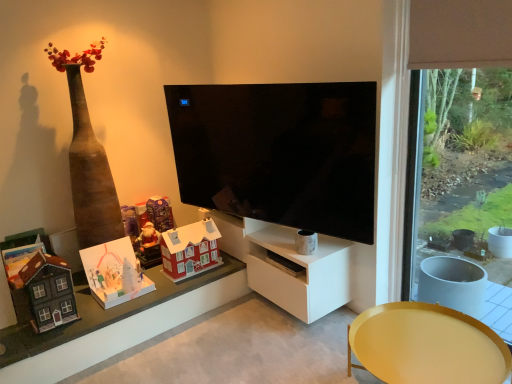
Question: Should I look upward or downward to see white paper pop-up at lower left, arranged as the 2th toy when viewed from the front?

Choices:
 (A) down
 (B) up

Answer: (A)

Question: Does matte plastic santa at center, which is the fourth toy in front-to-back order, have a greater height compared to white paper pop-up at lower left, arranged as the 2th toy when viewed from the front?

Choices:
 (A) no
 (B) yes

Answer: (B)

Question: Is white paper pop-up at lower left, arranged as the 2th toy when viewed from the front, completely or partially inside matte plastic santa at center, which is the fourth toy in front-to-back order?

Choices:
 (A) no
 (B) yes

Answer: (A)

Question: Does matte plastic santa at center, which is the fourth toy in front-to-back order, have a lesser width compared to white paper pop-up at lower left, arranged as the 2th toy when viewed from the front?

Choices:
 (A) no
 (B) yes

Answer: (B)

Question: From a real-world perspective, is matte plastic santa at center, which is the fourth toy in front-to-back order, over white paper pop-up at lower left, which is the 4th toy in back-to-front order?

Choices:
 (A) no
 (B) yes

Answer: (B)

Question: Is matte plastic santa at center, positioned as the second toy in back-to-front order, facing away from white paper pop-up at lower left, which is the 4th toy in back-to-front order?

Choices:
 (A) no
 (B) yes

Answer: (A)

Question: Does matte plastic santa at center, positioned as the second toy in back-to-front order, have a lesser height compared to white paper pop-up at lower left, which is the 4th toy in back-to-front order?

Choices:
 (A) yes
 (B) no

Answer: (B)

Question: From the image's perspective, is matte purple cardboard at upper left, the 5th toy when ordered from front to back, over matte red house at lower left?

Choices:
 (A) no
 (B) yes

Answer: (B)

Question: Is matte purple cardboard at upper left, acting as the first toy starting from the back, smaller than matte red house at lower left?

Choices:
 (A) yes
 (B) no

Answer: (A)

Question: Can you confirm if matte purple cardboard at upper left, the 5th toy when ordered from front to back, is thinner than matte red house at lower left?

Choices:
 (A) no
 (B) yes

Answer: (B)

Question: From a real-world perspective, is matte purple cardboard at upper left, the 5th toy when ordered from front to back, located beneath matte red house at lower left?

Choices:
 (A) yes
 (B) no

Answer: (B)

Question: Is matte purple cardboard at upper left, the 5th toy when ordered from front to back, at the right side of matte red house at lower left?

Choices:
 (A) no
 (B) yes

Answer: (B)

Question: Is matte purple cardboard at upper left, acting as the first toy starting from the back, closer to camera compared to matte red house at lower left?

Choices:
 (A) no
 (B) yes

Answer: (A)

Question: Can you confirm if matte red house at center, which appears as the third toy when viewed from the front, is thinner than matte red house at lower left?

Choices:
 (A) yes
 (B) no

Answer: (A)